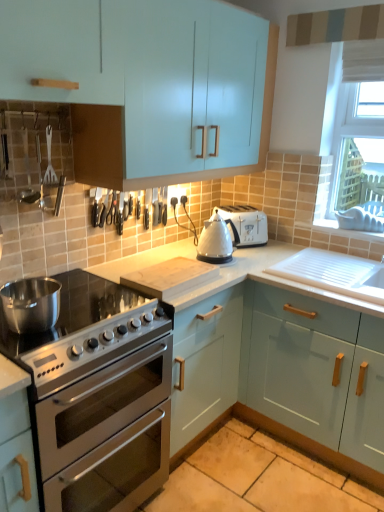
Describe the element at coordinates (358, 136) in the screenshot. Image resolution: width=384 pixels, height=512 pixels. I see `white plastic window screen at upper right` at that location.

Find the location of a particular element. This screenshot has height=512, width=384. matte light blue cabinet at center, the second cabinetry ordered from the bottom is located at coordinates (265, 279).

What are the coordinates of `brushed metal spatula at upper left` in the screenshot? It's located at (49, 159).

You are a GUI agent. You are given a task and a screenshot of the screen. Output one action in this format:
    pyautogui.click(x=<x>, y=<y>)
    Task: Click on the white glossy kettle at center, the second appliance ordered from the bottom
    The height and width of the screenshot is (512, 384).
    Given the screenshot: What is the action you would take?
    pyautogui.click(x=215, y=241)

Where is `wooden cutting board at center, marked as the 1th appliance in a bottom-to-top arrangement`? wooden cutting board at center, marked as the 1th appliance in a bottom-to-top arrangement is located at coordinates (170, 277).

From a real-world perspective, is matte light blue cabinet at center, the second cabinetry ordered from the bottom, positioned over light blue glossy cabinet at upper left, the third cabinetry positioned from the bottom, based on gravity?

Incorrect, from a real-world perspective, matte light blue cabinet at center, the second cabinetry ordered from the bottom, is lower than light blue glossy cabinet at upper left, the third cabinetry positioned from the bottom.

How different are the orientations of matte light blue cabinet at center, the second cabinetry ordered from the bottom, and light blue glossy cabinet at upper left, the third cabinetry positioned from the bottom, in degrees?

The angle between the facing direction of matte light blue cabinet at center, the second cabinetry ordered from the bottom, and the facing direction of light blue glossy cabinet at upper left, the third cabinetry positioned from the bottom, is 91.9 degrees.

Find the location of a particular element. Image resolution: width=384 pixels, height=512 pixels. cabinetry above the matte light blue cabinet at center, which is the second cabinetry from top to bottom (from the image's perspective) is located at coordinates (148, 84).

Could you tell me if matte light blue cabinet at center, the second cabinetry ordered from the bottom, is turned towards light blue glossy cabinet at upper left, the third cabinetry positioned from the bottom?

No, matte light blue cabinet at center, the second cabinetry ordered from the bottom, is not oriented towards light blue glossy cabinet at upper left, the third cabinetry positioned from the bottom.

Locate an element on the screen. This screenshot has width=384, height=512. gas stove that is below the polished stainless steel pot at left (from the image's perspective) is located at coordinates [x=73, y=310].

Who is bigger, satin silver gas stove at lower left or polished stainless steel pot at left?

satin silver gas stove at lower left.

Consider the image. Would you say satin silver gas stove at lower left contains polished stainless steel pot at left?

No, polished stainless steel pot at left is not surrounded by satin silver gas stove at lower left.

Between satin silver gas stove at lower left and polished stainless steel pot at left, which one has smaller width?

polished stainless steel pot at left is thinner.

Is light blue matte cabinet at lower right, the first cabinetry when ordered from bottom to top, facing towards satin silver gas stove at lower left?

Yes.

Considering the sizes of objects light blue matte cabinet at lower right, placed as the third cabinetry when sorted from top to bottom, and satin silver gas stove at lower left in the image provided, who is wider, light blue matte cabinet at lower right, placed as the third cabinetry when sorted from top to bottom, or satin silver gas stove at lower left?

Wider between the two is satin silver gas stove at lower left.

At what (x,y) coordinates should I click in order to perform the action: click on the 3rd cabinetry to the right of the satin silver gas stove at lower left, counting from the anchor's position. Please return your answer as a coordinate pair (x, y). The image size is (384, 512). Looking at the image, I should click on (311, 371).

From the image's perspective, is brushed metal spatula at upper left on top of white glossy kettle at center, the second appliance ordered from the bottom?

Yes.

Considering the relative sizes of brushed metal spatula at upper left and white glossy kettle at center, which is counted as the 1th appliance, starting from the top, in the image provided, is brushed metal spatula at upper left wider than white glossy kettle at center, which is counted as the 1th appliance, starting from the top,?

No, brushed metal spatula at upper left is not wider than white glossy kettle at center, which is counted as the 1th appliance, starting from the top.

Considering the sizes of objects brushed metal spatula at upper left and white glossy kettle at center, which is counted as the 1th appliance, starting from the top, in the image provided, who is taller, brushed metal spatula at upper left or white glossy kettle at center, which is counted as the 1th appliance, starting from the top,?

With more height is brushed metal spatula at upper left.

Is brushed metal spatula at upper left inside or outside of white glossy kettle at center, the second appliance ordered from the bottom?

brushed metal spatula at upper left is spatially situated outside white glossy kettle at center, the second appliance ordered from the bottom.

You are a GUI agent. You are given a task and a screenshot of the screen. Output one action in this format:
    pyautogui.click(x=<x>, y=<y>)
    Task: Click on the window screen on the right of matte plastic exhaust hood at upper center
    
    Given the screenshot: What is the action you would take?
    pyautogui.click(x=358, y=136)

Who is taller, white plastic window screen at upper right or matte plastic exhaust hood at upper center?

With more height is white plastic window screen at upper right.

Can you tell me how much white plastic window screen at upper right and matte plastic exhaust hood at upper center differ in facing direction?

The angle between the facing direction of white plastic window screen at upper right and the facing direction of matte plastic exhaust hood at upper center is 0.547 degrees.

Is white plastic window screen at upper right not close to matte plastic exhaust hood at upper center?

No.

From a real-world perspective, does light blue matte cabinet at lower right, placed as the third cabinetry when sorted from top to bottom, stand above matte plastic exhaust hood at upper center?

No, from a real-world perspective, light blue matte cabinet at lower right, placed as the third cabinetry when sorted from top to bottom, is not above matte plastic exhaust hood at upper center.

In terms of height, does light blue matte cabinet at lower right, placed as the third cabinetry when sorted from top to bottom, look taller or shorter compared to matte plastic exhaust hood at upper center?

Clearly, light blue matte cabinet at lower right, placed as the third cabinetry when sorted from top to bottom, is taller compared to matte plastic exhaust hood at upper center.

Is light blue matte cabinet at lower right, the first cabinetry when ordered from bottom to top, situated inside matte plastic exhaust hood at upper center or outside?

light blue matte cabinet at lower right, the first cabinetry when ordered from bottom to top, exists outside the volume of matte plastic exhaust hood at upper center.

From the image's perspective, between light blue matte cabinet at lower right, placed as the third cabinetry when sorted from top to bottom, and matte plastic exhaust hood at upper center, which one is located above?

matte plastic exhaust hood at upper center.

From the image's perspective, which object appears higher, satin silver gas stove at lower left or white glossy kettle at center, which is counted as the 1th appliance, starting from the top?

white glossy kettle at center, which is counted as the 1th appliance, starting from the top, is shown above in the image.

From the picture: Is satin silver gas stove at lower left further to camera compared to white glossy kettle at center, which is counted as the 1th appliance, starting from the top?

No, satin silver gas stove at lower left is in front of white glossy kettle at center, which is counted as the 1th appliance, starting from the top.

Does satin silver gas stove at lower left have a lesser height compared to white glossy kettle at center, which is counted as the 1th appliance, starting from the top?

Yes.

Considering the relative sizes of satin silver gas stove at lower left and white glossy kettle at center, the second appliance ordered from the bottom, in the image provided, is satin silver gas stove at lower left bigger than white glossy kettle at center, the second appliance ordered from the bottom,?

Indeed, satin silver gas stove at lower left has a larger size compared to white glossy kettle at center, the second appliance ordered from the bottom.

The height and width of the screenshot is (512, 384). I want to click on the 1st cabinetry below when counting from the light blue glossy cabinet at upper left, the third cabinetry positioned from the bottom (from the image's perspective), so click(x=265, y=279).

This screenshot has height=512, width=384. In order to click on kitchen appliance that appears on the left of satin silver gas stove at lower left in this screenshot , I will do `click(31, 304)`.

Estimate the real-world distances between objects in this image. Which object is closer to wooden cutting board at center, placed as the second appliance when sorted from top to bottom, white glossy kettle at center, which is counted as the 1th appliance, starting from the top, or polished stainless steel pot at left?

white glossy kettle at center, which is counted as the 1th appliance, starting from the top.

Considering their positions, is wooden cutting board at center, marked as the 1th appliance in a bottom-to-top arrangement, positioned closer to stainless steel oven at lower left than light blue glossy cabinet at upper left, the third cabinetry positioned from the bottom?

wooden cutting board at center, marked as the 1th appliance in a bottom-to-top arrangement, lies closer to stainless steel oven at lower left than the other object.

Considering their positions, is white glossy sink at lower right positioned closer to matte light blue cabinet at center, the second cabinetry ordered from the bottom, than light blue glossy cabinet at upper left, the third cabinetry positioned from the bottom?

white glossy sink at lower right is positioned closer to the anchor matte light blue cabinet at center, the second cabinetry ordered from the bottom.

Which object lies nearer to the anchor point white glossy sink at lower right, matte plastic exhaust hood at upper center or stainless steel oven at lower left?

Based on the image, stainless steel oven at lower left appears to be nearer to white glossy sink at lower right.

When comparing their distances from light blue glossy cabinet at upper left, the third cabinetry positioned from the bottom, does white glossy sink at lower right or stainless steel oven at lower left seem further?

Based on the image, stainless steel oven at lower left appears to be further to light blue glossy cabinet at upper left, the third cabinetry positioned from the bottom.

From the image, which object appears to be nearer to white plastic window screen at upper right, polished stainless steel pot at left or white glossy kettle at center, the second appliance ordered from the bottom?

white glossy kettle at center, the second appliance ordered from the bottom.

Considering their positions, is white glossy kettle at center, which is counted as the 1th appliance, starting from the top, positioned further to wooden cutting board at center, placed as the second appliance when sorted from top to bottom, than brushed metal spatula at upper left?

brushed metal spatula at upper left lies further to wooden cutting board at center, placed as the second appliance when sorted from top to bottom, than the other object.

When comparing their distances from stainless steel oven at lower left, does white glossy kettle at center, which is counted as the 1th appliance, starting from the top, or wooden cutting board at center, placed as the second appliance when sorted from top to bottom, seem further?

The object further to stainless steel oven at lower left is white glossy kettle at center, which is counted as the 1th appliance, starting from the top.

The width and height of the screenshot is (384, 512). Find the location of `kitchen appliance between brushed metal spatula at upper left and satin silver gas stove at lower left from top to bottom`. kitchen appliance between brushed metal spatula at upper left and satin silver gas stove at lower left from top to bottom is located at coordinates (31, 304).

The image size is (384, 512). Find the location of `sink positioned between light blue glossy cabinet at upper left, which is the first cabinetry from top to bottom, and white plastic toaster at upper right from near to far`. sink positioned between light blue glossy cabinet at upper left, which is the first cabinetry from top to bottom, and white plastic toaster at upper right from near to far is located at coordinates 334,273.

Locate an element on the screen. The image size is (384, 512). appliance positioned between polished stainless steel pot at left and white glossy kettle at center, the second appliance ordered from the bottom, from near to far is located at coordinates (170, 277).

The height and width of the screenshot is (512, 384). I want to click on kitchen appliance positioned between satin silver gas stove at lower left and white plastic toaster at upper right from near to far, so click(31, 304).